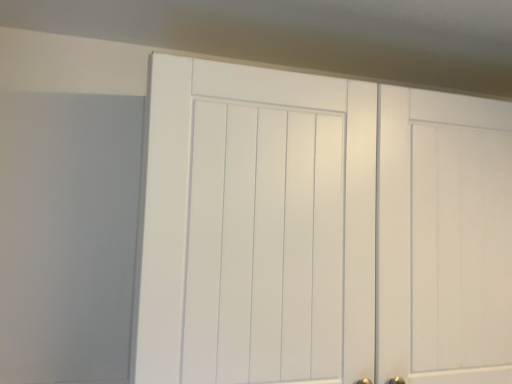
Image resolution: width=512 pixels, height=384 pixels. Find the location of `white matte cabinet door at upper center`. white matte cabinet door at upper center is located at coordinates (319, 229).

Describe the element at coordinates (319, 229) in the screenshot. I see `white matte cabinet door at upper center` at that location.

The image size is (512, 384). I want to click on white matte cabinet door at upper center, so click(319, 229).